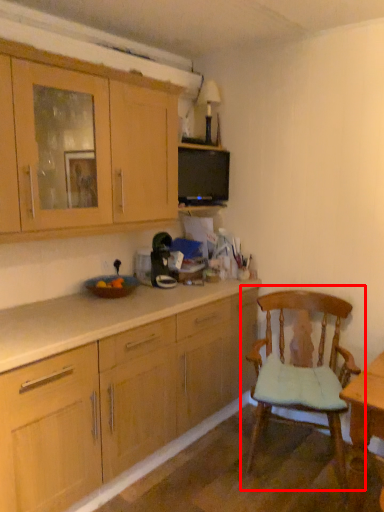
Question: From the image, what is the correct spatial relationship of chair (annotated by the red box) in relation to cabinetry?

Choices:
 (A) left
 (B) right

Answer: (B)